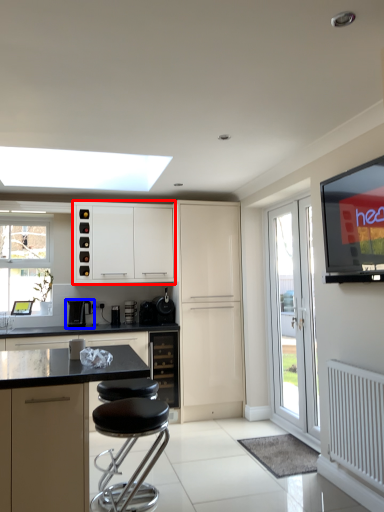
Question: Which point is further to the camera, cabinetry (highlighted by a red box) or coffee machine (highlighted by a blue box)?

Choices:
 (A) cabinetry
 (B) coffee machine

Answer: (B)